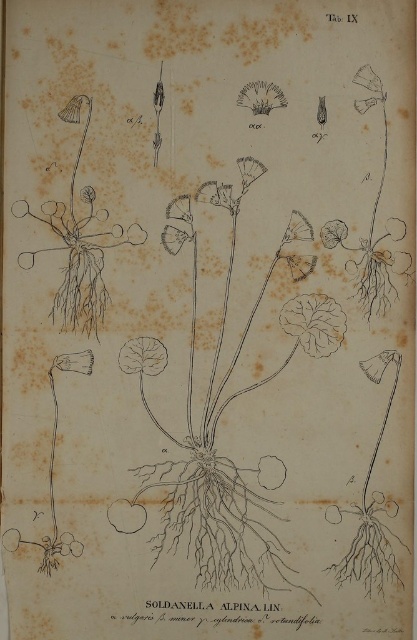
You are an artist sketching the green leafy plant at center. If your drawing paper is 1 meter wide, can you fit the entire plant on the paper without zooming in?

The green leafy plant at center is 1.23 meters from viewer, so it is wider than the paper. You cannot fit the entire plant on the paper without zooming in.

Based on the photo, based on the botanical illustration of Soldanella alpina Linnaeus, which object corresponds to the coordinates point (314, 323)?

The green leafy plant at center is represented by point (314, 323).